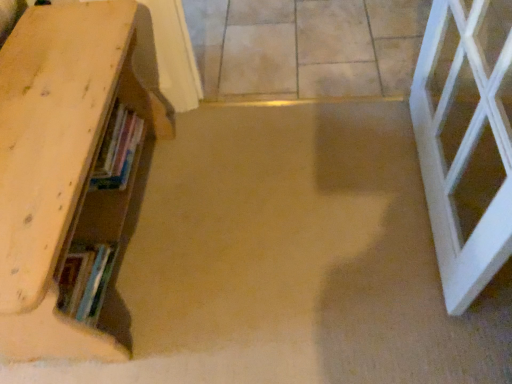
Question: Does beige tile floor at center have a greater width compared to wooden bookshelf at left?

Choices:
 (A) yes
 (B) no

Answer: (A)

Question: From a real-world perspective, is beige tile floor at center located higher than wooden bookshelf at left?

Choices:
 (A) no
 (B) yes

Answer: (A)

Question: Considering the relative sizes of beige tile floor at center and wooden bookshelf at left in the image provided, is beige tile floor at center taller than wooden bookshelf at left?

Choices:
 (A) yes
 (B) no

Answer: (B)

Question: Is beige tile floor at center positioned with its back to wooden bookshelf at left?

Choices:
 (A) no
 (B) yes

Answer: (A)

Question: Can you confirm if beige tile floor at center is shorter than wooden bookshelf at left?

Choices:
 (A) no
 (B) yes

Answer: (B)

Question: Choose the correct answer: Is hardcover books at left inside wooden bookshelf at left or outside it?

Choices:
 (A) outside
 (B) inside

Answer: (B)

Question: From the image's perspective, is hardcover books at left above or below wooden bookshelf at left?

Choices:
 (A) above
 (B) below

Answer: (A)

Question: Is hardcover books at left wider or thinner than wooden bookshelf at left?

Choices:
 (A) thin
 (B) wide

Answer: (A)

Question: In the image, is hardcover books at left positioned in front of or behind wooden bookshelf at left?

Choices:
 (A) behind
 (B) front

Answer: (A)

Question: Do you think hardcover books at left is within beige tile floor at center, or outside of it?

Choices:
 (A) outside
 (B) inside

Answer: (A)

Question: Is hardcover books at left taller or shorter than beige tile floor at center?

Choices:
 (A) tall
 (B) short

Answer: (A)

Question: From the image's perspective, is hardcover books at left positioned above or below beige tile floor at center?

Choices:
 (A) above
 (B) below

Answer: (B)

Question: From a real-world perspective, relative to beige tile floor at center, is hardcover books at left vertically above or below?

Choices:
 (A) above
 (B) below

Answer: (A)

Question: Considering the relative positions of beige tile floor at center and wooden bookshelf at left in the image provided, is beige tile floor at center to the left or to the right of wooden bookshelf at left?

Choices:
 (A) left
 (B) right

Answer: (B)

Question: Is point (236, 16) positioned closer to the camera than point (31, 59)?

Choices:
 (A) closer
 (B) farther

Answer: (B)